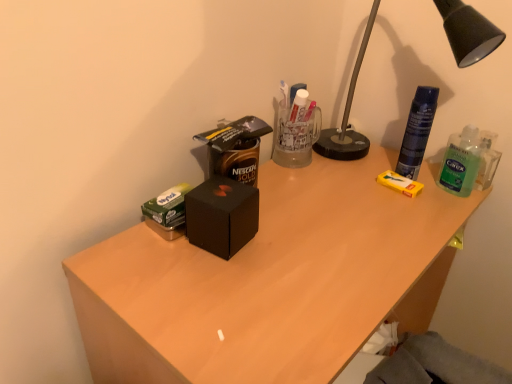
Question: Is black matte box at center next to green translucent hand sanitizer at right and touching it?

Choices:
 (A) yes
 (B) no

Answer: (B)

Question: Is green translucent hand sanitizer at right surrounded by black matte box at center?

Choices:
 (A) no
 (B) yes

Answer: (A)

Question: Is black matte box at center outside green translucent hand sanitizer at right?

Choices:
 (A) yes
 (B) no

Answer: (A)

Question: Is black matte box at center taller than green translucent hand sanitizer at right?

Choices:
 (A) yes
 (B) no

Answer: (B)

Question: Can you confirm if black matte box at center is shorter than green translucent hand sanitizer at right?

Choices:
 (A) yes
 (B) no

Answer: (A)

Question: Is green translucent hand sanitizer at right in front of or behind matte black box at center in the image?

Choices:
 (A) front
 (B) behind

Answer: (B)

Question: Is green translucent hand sanitizer at right taller or shorter than matte black box at center?

Choices:
 (A) short
 (B) tall

Answer: (A)

Question: From the image's perspective, is green translucent hand sanitizer at right above or below matte black box at center?

Choices:
 (A) above
 (B) below

Answer: (A)

Question: Is green translucent hand sanitizer at right wider or thinner than matte black box at center?

Choices:
 (A) thin
 (B) wide

Answer: (A)

Question: Is black matte box at center situated inside green translucent hand sanitizer at right or outside?

Choices:
 (A) inside
 (B) outside

Answer: (B)

Question: From a real-world perspective, relative to green translucent hand sanitizer at right, is black matte box at center vertically above or below?

Choices:
 (A) below
 (B) above

Answer: (A)

Question: From the image's perspective, is black matte box at center above or below green translucent hand sanitizer at right?

Choices:
 (A) above
 (B) below

Answer: (B)

Question: In the image, is black matte box at center positioned in front of or behind green translucent hand sanitizer at right?

Choices:
 (A) behind
 (B) front

Answer: (B)

Question: Looking at the image, does green translucent hand sanitizer at right seem bigger or smaller compared to black metal lamp at upper right?

Choices:
 (A) small
 (B) big

Answer: (A)

Question: Considering the positions of point (468, 147) and point (467, 62), is point (468, 147) closer or farther from the camera than point (467, 62)?

Choices:
 (A) closer
 (B) farther

Answer: (B)